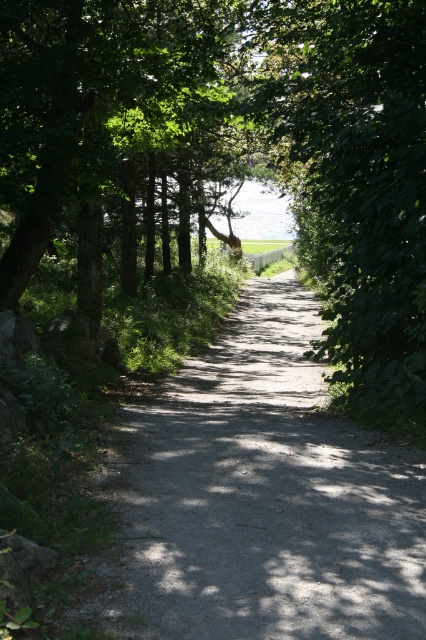
Between green leafy tree at center and dirt/gravel path at center, which one appears on the right side from the viewer's perspective?

green leafy tree at center

Is point (281, 122) farther from camera compared to point (388, 600)?

Yes, point (281, 122) is farther from viewer.

Is point (155, 132) less distant than point (131, 522)?

No, it is behind (131, 522).

The image size is (426, 640). I want to click on green leafy tree at center, so click(x=236, y=147).